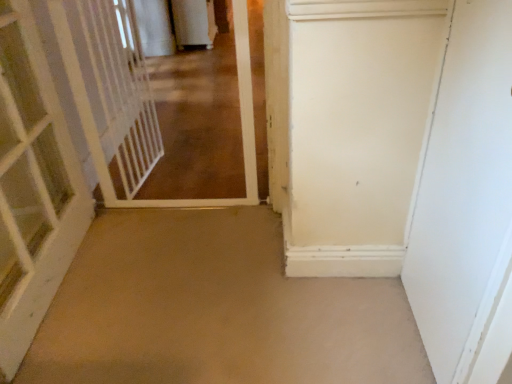
Question: Relative to white plastic gate at left, is beige carpet at center in front or behind?

Choices:
 (A) behind
 (B) front

Answer: (B)

Question: Looking at their shapes, would you say beige carpet at center is wider or thinner than white plastic gate at left?

Choices:
 (A) wide
 (B) thin

Answer: (A)

Question: Which object is positioned closest to the white plastic gate at left?

Choices:
 (A) white wooden door at left, the 2th door viewed from the right
 (B) white matte door at right, which is counted as the second door, starting from the left
 (C) white glossy gate at upper left
 (D) beige carpet at center

Answer: (A)

Question: Which object is positioned closest to the beige carpet at center?

Choices:
 (A) white matte door at right, which is counted as the second door, starting from the left
 (B) white plastic gate at left
 (C) white glossy gate at upper left
 (D) white wooden door at left, marked as the first door in a left-to-right arrangement

Answer: (D)